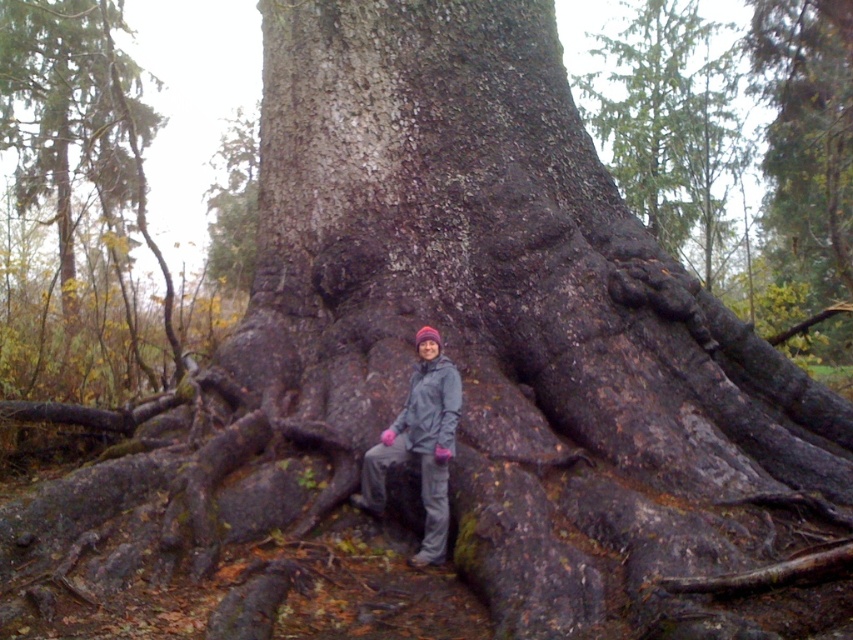
Can you confirm if dark brown bark at upper center is thinner than gray fabric jacket at center?

→ No.

Describe the element at coordinates (670, 125) in the screenshot. I see `dark brown bark at upper center` at that location.

Between point (656, 112) and point (422, 433), which one is positioned in front?

Point (422, 433) is in front.

Locate an element on the screen. The image size is (853, 640). dark brown bark at upper center is located at coordinates (670, 125).

Between dark brown bark at center and gray fabric jacket at center, which one has more height?

gray fabric jacket at center is taller.

Is point (140, 230) closer to camera compared to point (434, 332)?

No, it is behind (434, 332).

The height and width of the screenshot is (640, 853). In order to click on dark brown bark at center in this screenshot , I will do `click(78, 131)`.

In the scene shown: Can you confirm if dark brown bark at center is taller than dark brown bark at upper center?

Incorrect, dark brown bark at center's height is not larger of dark brown bark at upper center's.

Is dark brown bark at center shorter than dark brown bark at upper center?

Yes.

Where is `dark brown bark at center`? The image size is (853, 640). dark brown bark at center is located at coordinates (78, 131).

Locate an element on the screen. dark brown bark at center is located at coordinates (78, 131).